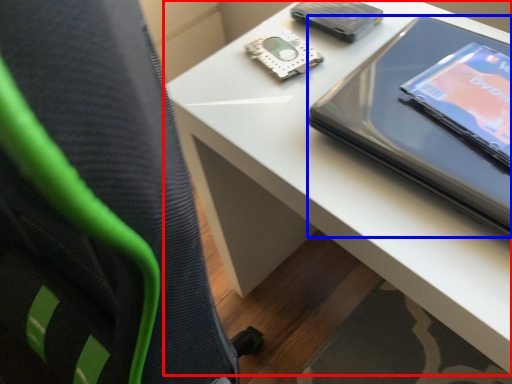
Question: Among these objects, which one is farthest to the camera, table (highlighted by a red box) or tablet computer (highlighted by a blue box)?

Choices:
 (A) table
 (B) tablet computer

Answer: (B)